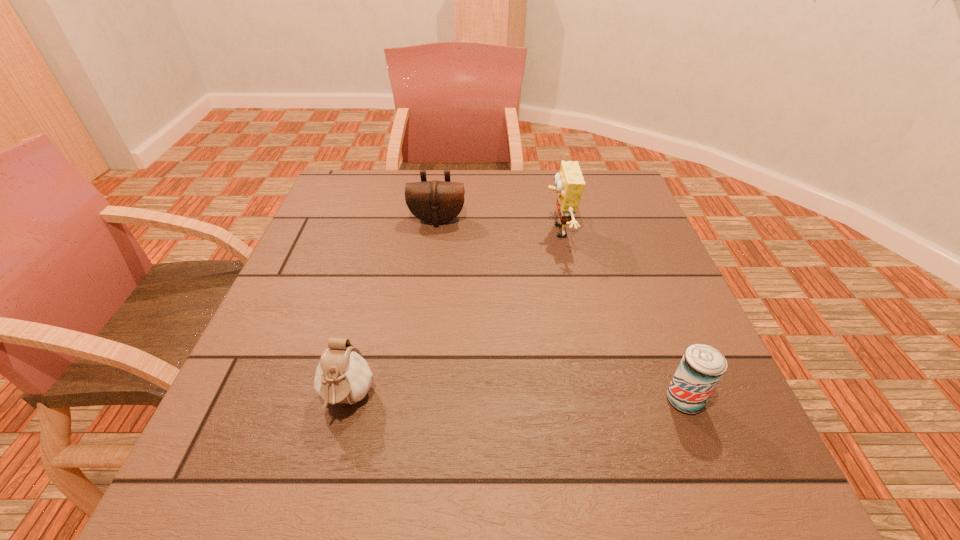
The image size is (960, 540). In order to click on object that is the third nearest to the second object from right to left in this screenshot , I will do `click(343, 376)`.

Select which object is the second closest to the farther pouch. Please provide its 2D coordinates. Your answer should be formatted as a tuple, i.e. [(x, y)], where the tuple contains the x and y coordinates of a point satisfying the conditions above.

[(343, 376)]

What are the coordinates of `vacant space that satisfies the following two spatial constraints: 1. on the face of the tallest object; 2. on the front-facing side of the nearer pouch` in the screenshot? It's located at (594, 400).

Locate an element on the screen. The height and width of the screenshot is (540, 960). vacant region that satisfies the following two spatial constraints: 1. on the face of the rightmost object; 2. on the left side of the sponge is located at coordinates (594, 400).

I want to click on vacant area in the image that satisfies the following two spatial constraints: 1. on the face of the sponge; 2. on the front-facing side of the nearer pouch, so click(x=594, y=400).

The width and height of the screenshot is (960, 540). Find the location of `vacant space that satisfies the following two spatial constraints: 1. on the front-facing side of the beer can; 2. on the right side of the nearer pouch`. vacant space that satisfies the following two spatial constraints: 1. on the front-facing side of the beer can; 2. on the right side of the nearer pouch is located at coordinates (348, 400).

In order to click on vacant region that satisfies the following two spatial constraints: 1. on the front-facing side of the nearer pouch; 2. on the left side of the beer can in this screenshot , I will do `click(348, 400)`.